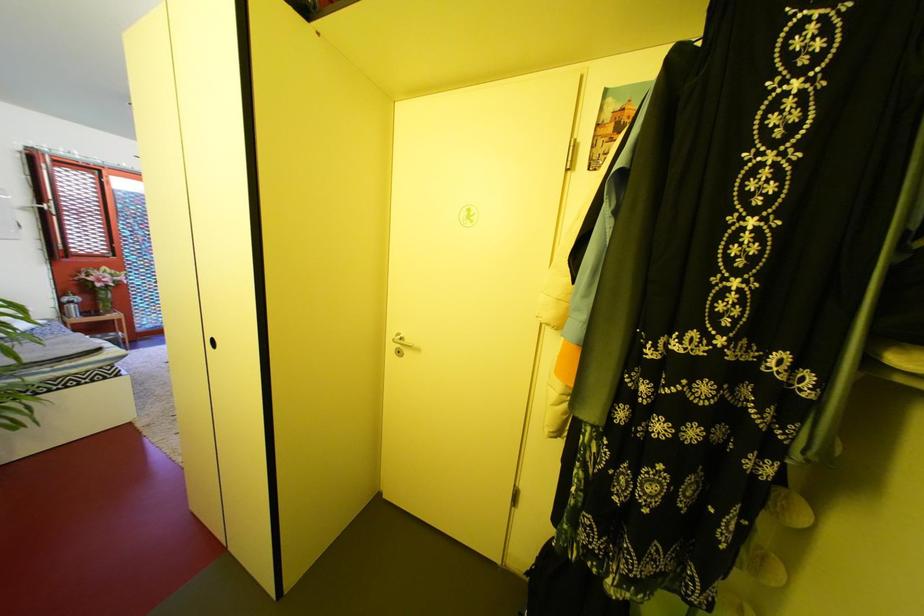
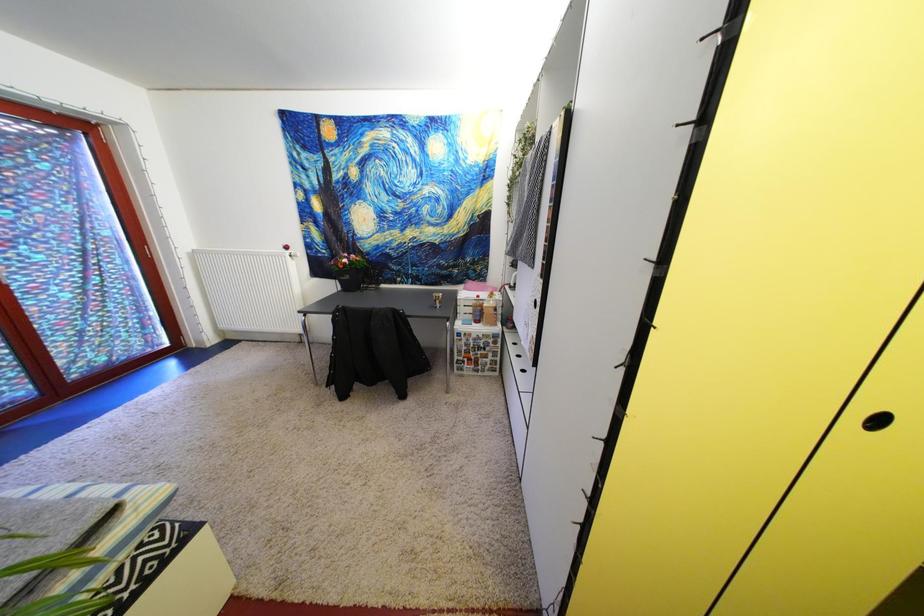
In a continuous first-person perspective shot, in which direction is the camera moving?

The movement direction of the cameraman is left, forward.